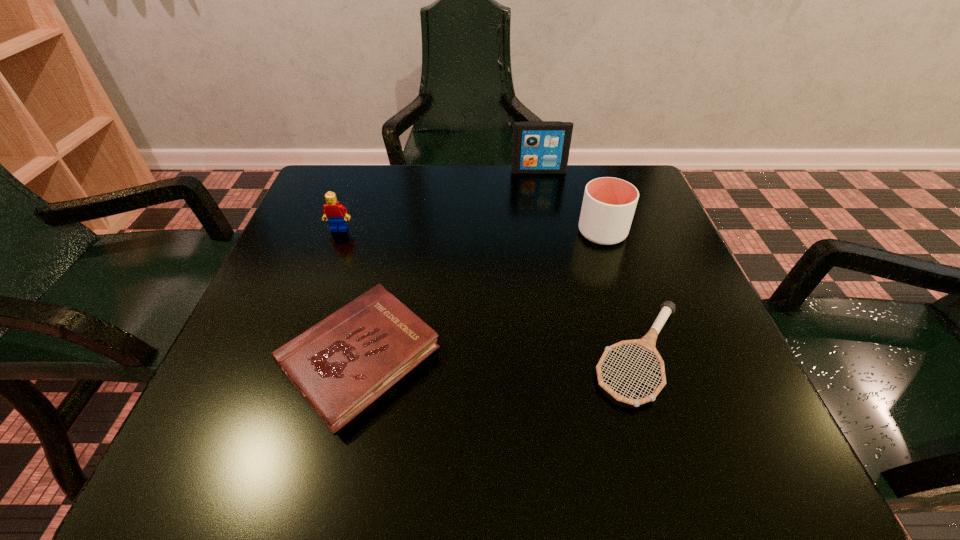
In the image, there is a desktop. Identify the location of vacant space at the far edge. The width and height of the screenshot is (960, 540). (484, 199).

Identify the location of free space at the near edge of the desktop. The width and height of the screenshot is (960, 540). (446, 450).

In the image, there is a desktop. Identify the location of free space at the left edge. (277, 265).

Where is `free spot at the right edge of the desktop`? The image size is (960, 540). free spot at the right edge of the desktop is located at coordinates (691, 302).

The height and width of the screenshot is (540, 960). I want to click on vacant region at the far left corner, so click(368, 202).

The width and height of the screenshot is (960, 540). What are the coordinates of `vacant space at the far right corner` in the screenshot? It's located at (623, 175).

At what (x,y) coordinates should I click in order to perform the action: click on unoccupied area between the cup and the hardback book. Please return your answer as a coordinate pair (x, y). This screenshot has width=960, height=540. Looking at the image, I should click on (481, 296).

This screenshot has width=960, height=540. I want to click on vacant region between the Lego and the tennis racket, so click(490, 292).

This screenshot has width=960, height=540. What are the coordinates of `free space between the Lego and the shortest object` in the screenshot? It's located at (490, 292).

Identify the location of free space between the hardback book and the tennis racket. (500, 357).